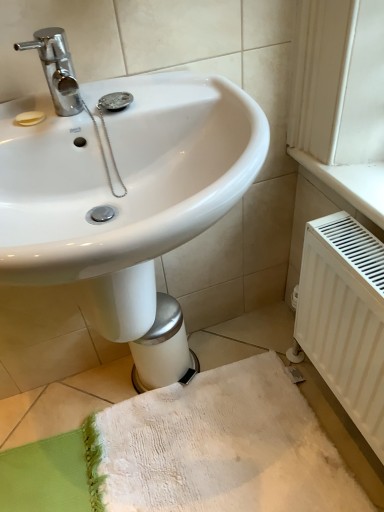
Question: Is white matte radiator at lower right far away from white textured bath towel at lower center?

Choices:
 (A) yes
 (B) no

Answer: (B)

Question: Considering the relative sizes of white matte radiator at lower right and white textured bath towel at lower center in the image provided, is white matte radiator at lower right bigger than white textured bath towel at lower center?

Choices:
 (A) no
 (B) yes

Answer: (B)

Question: Is white matte radiator at lower right not inside white textured bath towel at lower center?

Choices:
 (A) no
 (B) yes

Answer: (B)

Question: Does white matte radiator at lower right have a lesser height compared to white textured bath towel at lower center?

Choices:
 (A) yes
 (B) no

Answer: (B)

Question: Is white textured bath towel at lower center at the back of white matte radiator at lower right?

Choices:
 (A) no
 (B) yes

Answer: (A)

Question: From a real-world perspective, is white matte radiator at lower right under white textured bath towel at lower center?

Choices:
 (A) yes
 (B) no

Answer: (B)

Question: From the image's perspective, is white textured bath towel at lower center located above white matte radiator at lower right?

Choices:
 (A) yes
 (B) no

Answer: (B)

Question: Is white textured bath towel at lower center positioned far away from white matte radiator at lower right?

Choices:
 (A) yes
 (B) no

Answer: (B)

Question: Is white textured bath towel at lower center wider than white matte radiator at lower right?

Choices:
 (A) yes
 (B) no

Answer: (A)

Question: Is white textured bath towel at lower center beside white matte radiator at lower right?

Choices:
 (A) yes
 (B) no

Answer: (B)

Question: Considering the relative sizes of white textured bath towel at lower center and white matte radiator at lower right in the image provided, is white textured bath towel at lower center thinner than white matte radiator at lower right?

Choices:
 (A) yes
 (B) no

Answer: (B)

Question: From a real-world perspective, is white textured bath towel at lower center positioned over white matte radiator at lower right based on gravity?

Choices:
 (A) no
 (B) yes

Answer: (A)

Question: Which is correct: white matte radiator at lower right is inside white textured bath towel at lower center, or outside of it?

Choices:
 (A) outside
 (B) inside

Answer: (A)